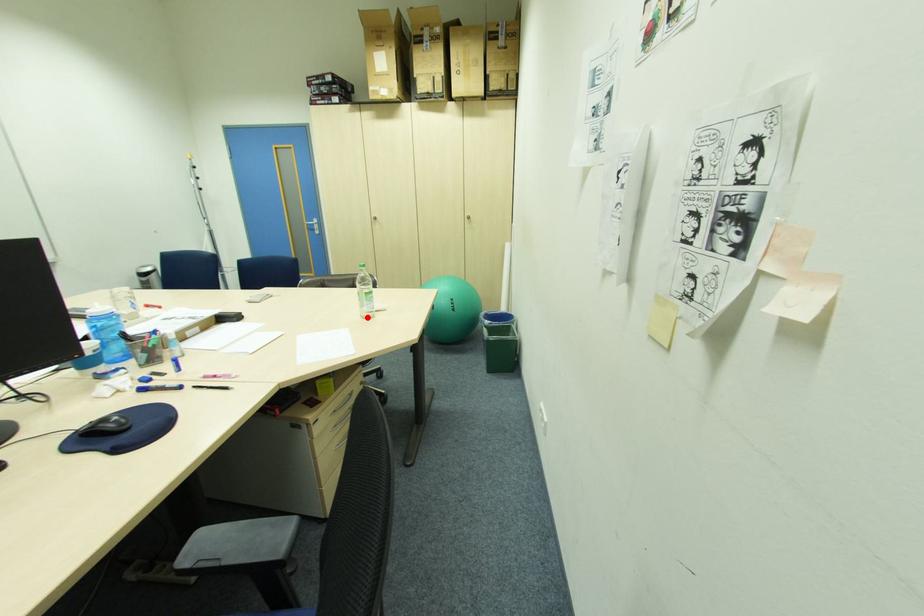
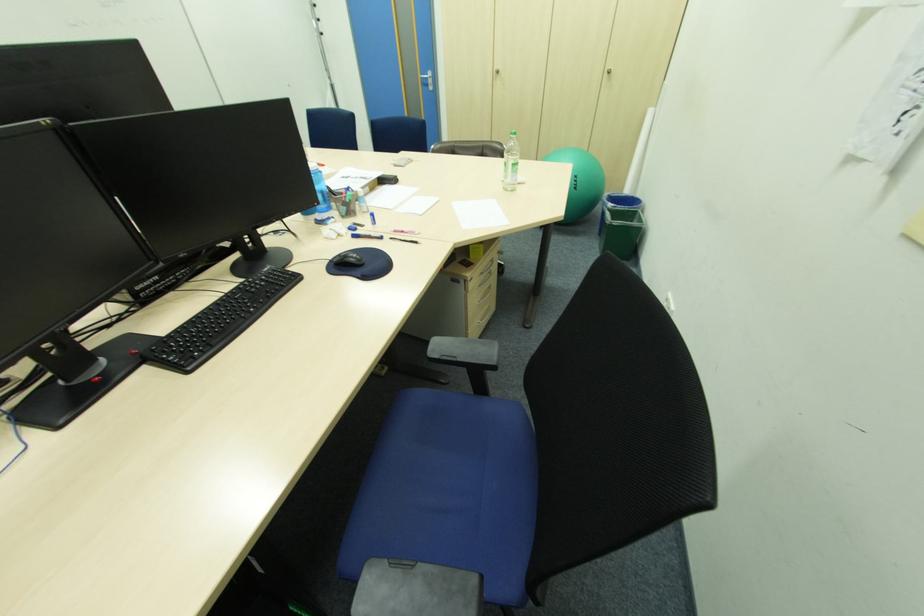
In the second image, find the point that corresponds to the highlighted location in the first image.

(511, 190)